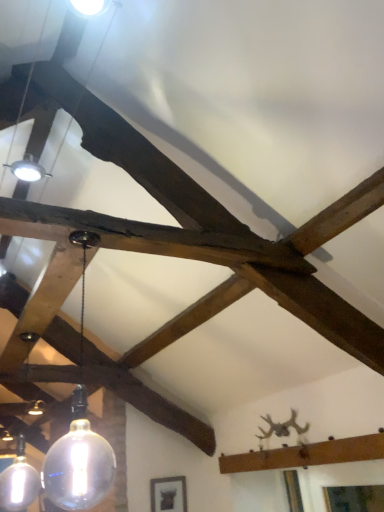
What do you see at coordinates (19, 481) in the screenshot? I see `matte glass globe at lower left, positioned as the second lamp in front-to-back order` at bounding box center [19, 481].

What is the approximate width of matte glass globe at lower left, which is the second lamp from right to left?

matte glass globe at lower left, which is the second lamp from right to left, is 8.58 inches wide.

The width and height of the screenshot is (384, 512). What do you see at coordinates (79, 438) in the screenshot? I see `transparent glass bulb at center, the 2th lamp from the back` at bounding box center [79, 438].

Locate an element on the screen. matte black frame at lower center is located at coordinates (168, 494).

From the image's perspective, would you say transparent glass bulb at center, which is the 2th lamp from left to right, is shown under matte black frame at lower center?

No.

In the scene shown: Which object is thinner, transparent glass bulb at center, positioned as the first lamp in right-to-left order, or matte black frame at lower center?

matte black frame at lower center is thinner.

Is transparent glass bulb at center, positioned as the first lamp in right-to-left order, far from matte black frame at lower center?

transparent glass bulb at center, positioned as the first lamp in right-to-left order, is far away from matte black frame at lower center.

Does matte glass globe at lower left, positioned as the second lamp in front-to-back order, have a greater height compared to transparent glass bulb at center, positioned as the first lamp in right-to-left order?

Incorrect, the height of matte glass globe at lower left, positioned as the second lamp in front-to-back order, is not larger of that of transparent glass bulb at center, positioned as the first lamp in right-to-left order.

Locate an element on the screen. This screenshot has height=512, width=384. lamp above the matte glass globe at lower left, the 1th lamp positioned from the back (from the image's perspective) is located at coordinates (79, 438).

Would you say matte glass globe at lower left, positioned as the second lamp in front-to-back order, is outside transparent glass bulb at center, the first lamp in the front-to-back sequence?

Yes.

Is point (151, 507) positioned behind point (5, 475)?

Yes, point (151, 507) is farther from viewer.

How far apart are matte black frame at lower center and matte glass globe at lower left, the 1th lamp when ordered from left to right?

The distance of matte black frame at lower center from matte glass globe at lower left, the 1th lamp when ordered from left to right, is 1.57 meters.

From the image's perspective, would you say matte black frame at lower center is positioned over matte glass globe at lower left, the 1th lamp positioned from the back?

Actually, matte black frame at lower center appears below matte glass globe at lower left, the 1th lamp positioned from the back, in the image.

From the image's perspective, between matte glass globe at lower left, the 1th lamp when ordered from left to right, and matte black frame at lower center, which one is located above?

matte glass globe at lower left, the 1th lamp when ordered from left to right, from the image's perspective.

Who is shorter, matte glass globe at lower left, which is the second lamp from right to left, or matte black frame at lower center?

With less height is matte black frame at lower center.

Are matte glass globe at lower left, positioned as the second lamp in front-to-back order, and matte black frame at lower center far apart?

Indeed, matte glass globe at lower left, positioned as the second lamp in front-to-back order, is not near matte black frame at lower center.

Can you tell me how much matte glass globe at lower left, the 1th lamp when ordered from left to right, and matte black frame at lower center differ in facing direction?

matte glass globe at lower left, the 1th lamp when ordered from left to right, and matte black frame at lower center are facing 0.539 degrees away from each other.

In terms of width, does matte black frame at lower center look wider or thinner when compared to transparent glass bulb at center, positioned as the first lamp in right-to-left order?

Considering their sizes, matte black frame at lower center looks slimmer than transparent glass bulb at center, positioned as the first lamp in right-to-left order.

From the image's perspective, is matte black frame at lower center located above or below transparent glass bulb at center, the first lamp in the front-to-back sequence?

matte black frame at lower center is below transparent glass bulb at center, the first lamp in the front-to-back sequence.

Considering the positions of objects matte black frame at lower center and transparent glass bulb at center, which is the 2th lamp from left to right, in the image provided, who is in front, matte black frame at lower center or transparent glass bulb at center, which is the 2th lamp from left to right,?

transparent glass bulb at center, which is the 2th lamp from left to right.

Between matte black frame at lower center and transparent glass bulb at center, which is the 2th lamp from left to right, which one has more height?

transparent glass bulb at center, which is the 2th lamp from left to right.

Considering the relative sizes of transparent glass bulb at center, the 2th lamp from the back, and matte glass globe at lower left, positioned as the second lamp in front-to-back order, in the image provided, is transparent glass bulb at center, the 2th lamp from the back, taller than matte glass globe at lower left, positioned as the second lamp in front-to-back order,?

Yes, transparent glass bulb at center, the 2th lamp from the back, is taller than matte glass globe at lower left, positioned as the second lamp in front-to-back order.

Can you tell me how much transparent glass bulb at center, positioned as the first lamp in right-to-left order, and matte glass globe at lower left, the 1th lamp when ordered from left to right, differ in facing direction?

0.00248 degrees.

From a real-world perspective, who is located lower, transparent glass bulb at center, positioned as the first lamp in right-to-left order, or matte glass globe at lower left, the 1th lamp when ordered from left to right?

From a 3D spatial view, matte glass globe at lower left, the 1th lamp when ordered from left to right, is below.

Locate an element on the screen. The image size is (384, 512). lamp that is the 2nd object above the matte black frame at lower center (from a real-world perspective) is located at coordinates (79, 438).

Locate an element on the screen. The width and height of the screenshot is (384, 512). lamp lying behind the transparent glass bulb at center, positioned as the first lamp in right-to-left order is located at coordinates (19, 481).

Looking at this image, when comparing their distances from matte black frame at lower center, does transparent glass bulb at center, the 2th lamp from the back, or matte glass globe at lower left, positioned as the second lamp in front-to-back order, seem closer?

Based on the image, matte glass globe at lower left, positioned as the second lamp in front-to-back order, appears to be nearer to matte black frame at lower center.

Looking at the image, which one is located closer to matte glass globe at lower left, positioned as the second lamp in front-to-back order, matte black frame at lower center or transparent glass bulb at center, the 2th lamp from the back?

transparent glass bulb at center, the 2th lamp from the back, is positioned closer to the anchor matte glass globe at lower left, positioned as the second lamp in front-to-back order.

Estimate the real-world distances between objects in this image. Which object is further from matte glass globe at lower left, which is the second lamp from right to left, transparent glass bulb at center, the first lamp in the front-to-back sequence, or matte black frame at lower center?

Based on the image, matte black frame at lower center appears to be further to matte glass globe at lower left, which is the second lamp from right to left.

From the image, which object appears to be nearer to transparent glass bulb at center, positioned as the first lamp in right-to-left order, matte glass globe at lower left, the 1th lamp when ordered from left to right, or matte black frame at lower center?

matte glass globe at lower left, the 1th lamp when ordered from left to right, is positioned closer to the anchor transparent glass bulb at center, positioned as the first lamp in right-to-left order.

Looking at this image, based on their spatial positions, is matte black frame at lower center or matte glass globe at lower left, which is the second lamp from right to left, further from transparent glass bulb at center, positioned as the first lamp in right-to-left order?

matte black frame at lower center lies further to transparent glass bulb at center, positioned as the first lamp in right-to-left order, than the other object.

Considering their positions, is matte glass globe at lower left, which is the second lamp from right to left, positioned further to matte black frame at lower center than transparent glass bulb at center, which is the 2th lamp from left to right?

transparent glass bulb at center, which is the 2th lamp from left to right, lies further to matte black frame at lower center than the other object.

This screenshot has height=512, width=384. I want to click on lamp between transparent glass bulb at center, which is the 2th lamp from left to right, and matte black frame at lower center in the front-back direction, so click(19, 481).